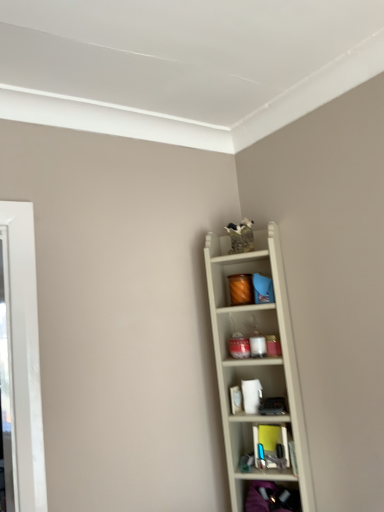
This screenshot has height=512, width=384. I want to click on empty space that is ontop of matte black shoes at lower right, the second shelf from the top (from a real-world perspective), so click(276, 476).